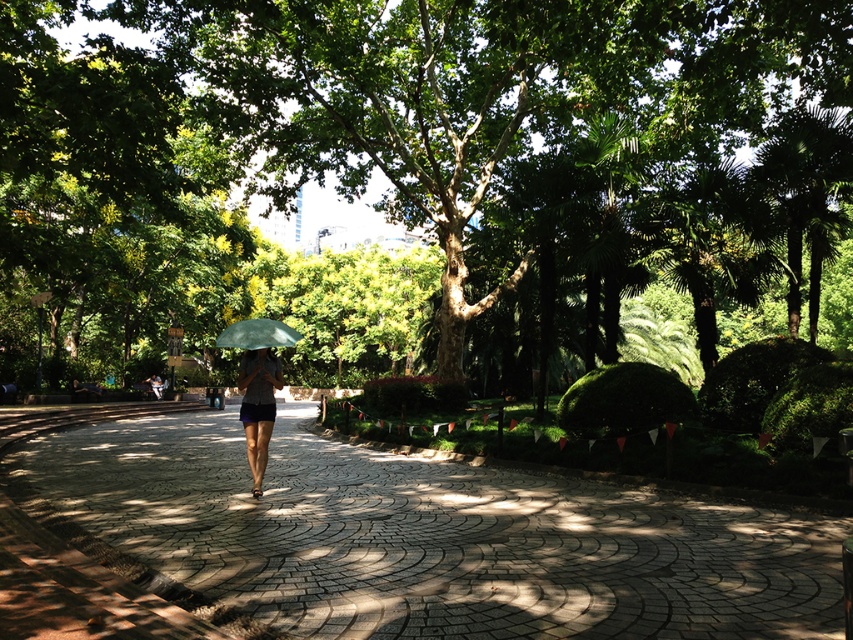
You are a park visitor holding a green matte umbrella at center and want to walk towards the gray cobblestone pavement at center. Which direction should you move relative to your current position?

The gray cobblestone pavement at center is to the right of the green matte umbrella at center, so you should move to your right to reach it.

You are planning to place a large picnic blanket on the gray cobblestone pavement at center. Considering the space available, will the green leafy tree at center interfere with the placement?

The green leafy tree at center has a larger width than the gray cobblestone pavement at center, so placing a large picnic blanket might be challenging due to the tree occupying most of the pavement area.

Based on the photo, you are a photographer standing at the entrance of the park and see both the dark gray fabric umbrella at center and the green matte umbrella at center. Which umbrella is closer to the ground?

The dark gray fabric umbrella at center is located below the green matte umbrella at center, so it is closer to the ground.